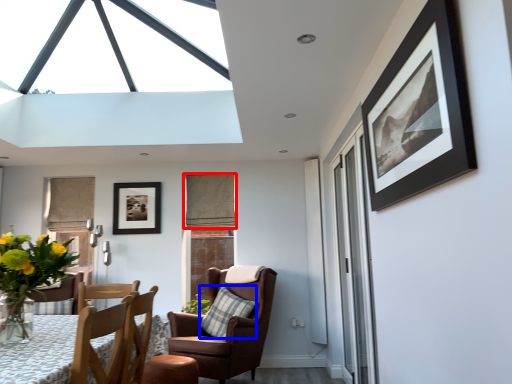
Question: Among these objects, which one is farthest to the camera, curtain (highlighted by a red box) or pillow (highlighted by a blue box)?

Choices:
 (A) curtain
 (B) pillow

Answer: (A)